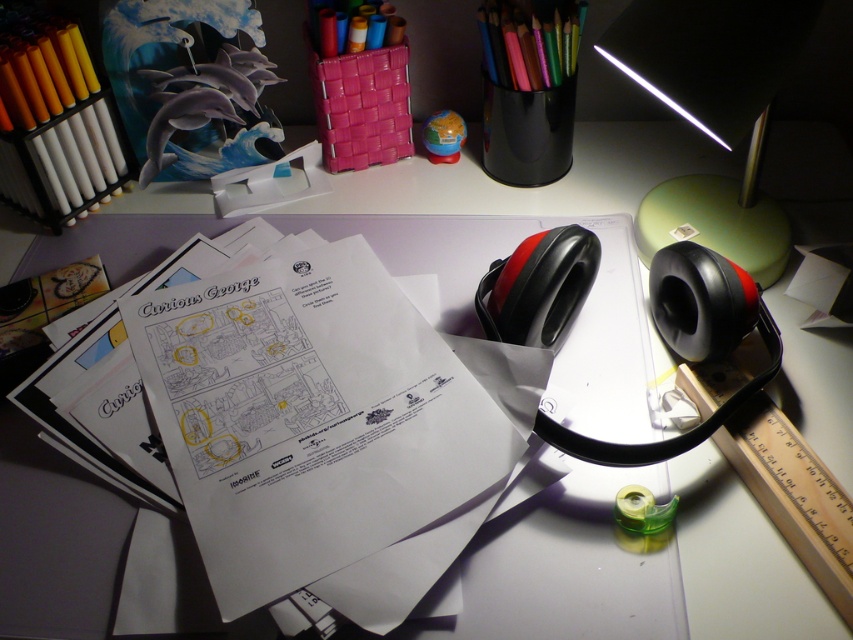
You are organizing your desk and need to place a new item between the colored pencils at upper right and the matte plastic markers at upper center. Based on their positions, where should you place it to ensure it is centered between them?

Since the colored pencils at upper right is to the right of the matte plastic markers at upper center, placing the new item between them would require positioning it to the left of the colored pencils at upper right and to the right of the matte plastic markers at upper center, effectively centering it between the two.

You need to place both the black matte mouse at upper center and the matte yellow pencil at upper left into a storage box. The box can only fit items up to the size of the pencil. Can both items fit?

The black matte mouse at upper center is wider than the matte yellow pencil at upper left, so it cannot fit into the storage box designed for items up to the pencil size. The pencil will fit, but the mouse will not.